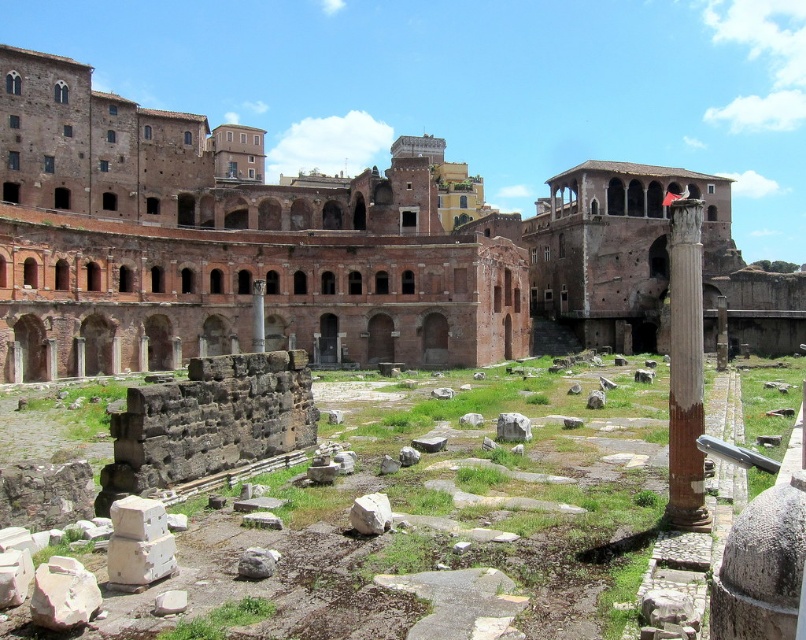
Is rustic stone ruins at center below smooth stone column at right?

Indeed, rustic stone ruins at center is positioned under smooth stone column at right.

From the picture: Measure the distance from rustic stone ruins at center to smooth stone column at right.

rustic stone ruins at center is 17.69 meters from smooth stone column at right.

In order to click on rustic stone ruins at center in this screenshot , I will do `click(437, 524)`.

Can you confirm if reddish-brown stone ruins at center is shorter than rustic stone ruins at center?

No.

Does point (239, 132) come closer to viewer compared to point (520, 611)?

That is False.

What do you see at coordinates (219, 246) in the screenshot? I see `reddish-brown stone ruins at center` at bounding box center [219, 246].

This screenshot has width=806, height=640. I want to click on reddish-brown stone ruins at center, so click(x=219, y=246).

Is point (268, 193) positioned after point (692, 291)?

Yes, it is behind point (692, 291).

In the scene shown: Which is below, reddish-brown stone ruins at center or smooth stone column at right?

Positioned lower is smooth stone column at right.

Is point (165, 324) positioned behind point (684, 244)?

That is True.

At what (x,y) coordinates should I click in order to perform the action: click on reddish-brown stone ruins at center. Please return your answer as a coordinate pair (x, y). Looking at the image, I should click on (219, 246).